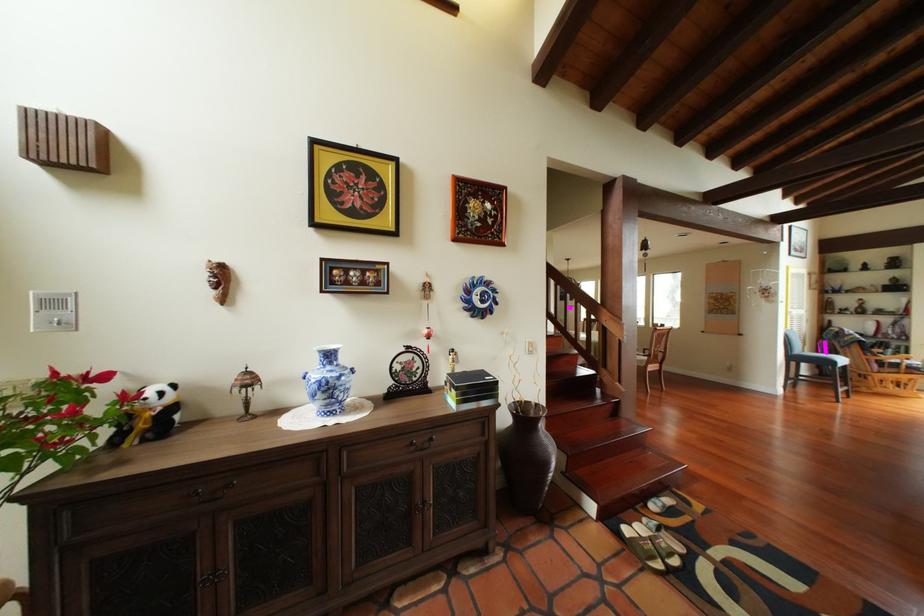
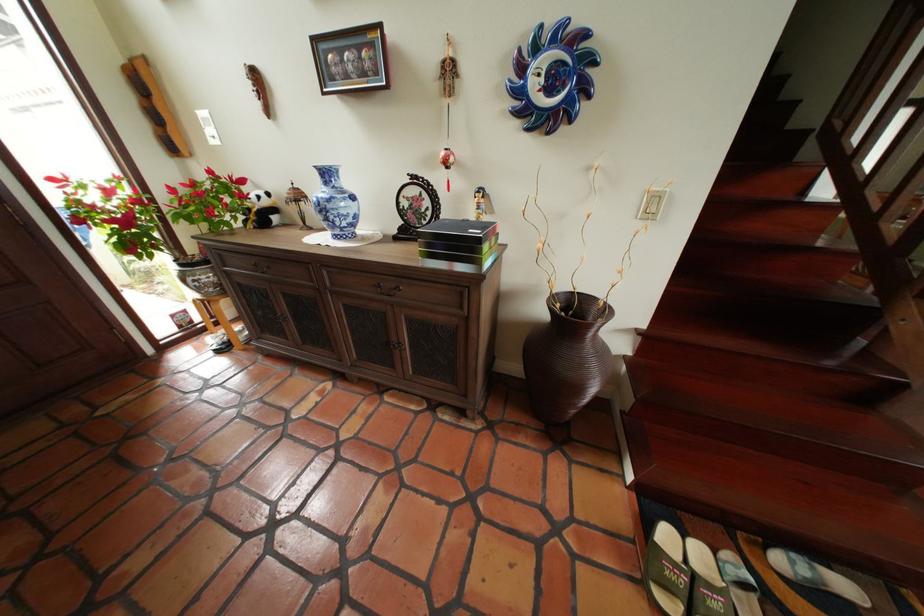
In the second image, find the point that corresponds to the point at 653,567 in the first image.

(651, 578)